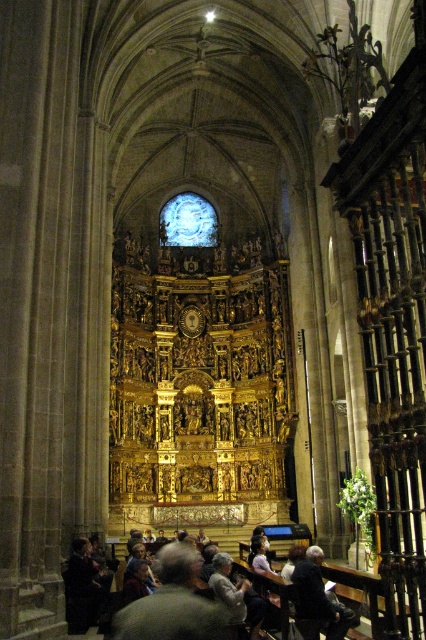
You are standing in the cathedral and want to place a small flower vase exactly at the center of the dark blue fabric at lower center. According to the coordinates provided, where should you place the vase?

Result: The dark blue fabric at lower center is located at the 2D coordinates point (317, 600), so you should place the vase exactly at that coordinate point to center it.

You are standing in the cathedral and want to determine the relative positions of two points marked in the image. Which point is closer to you, point 1 at coordinates point (x=305, y=577) or point 2 at coordinates point (x=354, y=632)?

Point 1 at coordinates point (x=305, y=577) is closer to you because it is further to the viewer than point 2 at coordinates point (x=354, y=632).